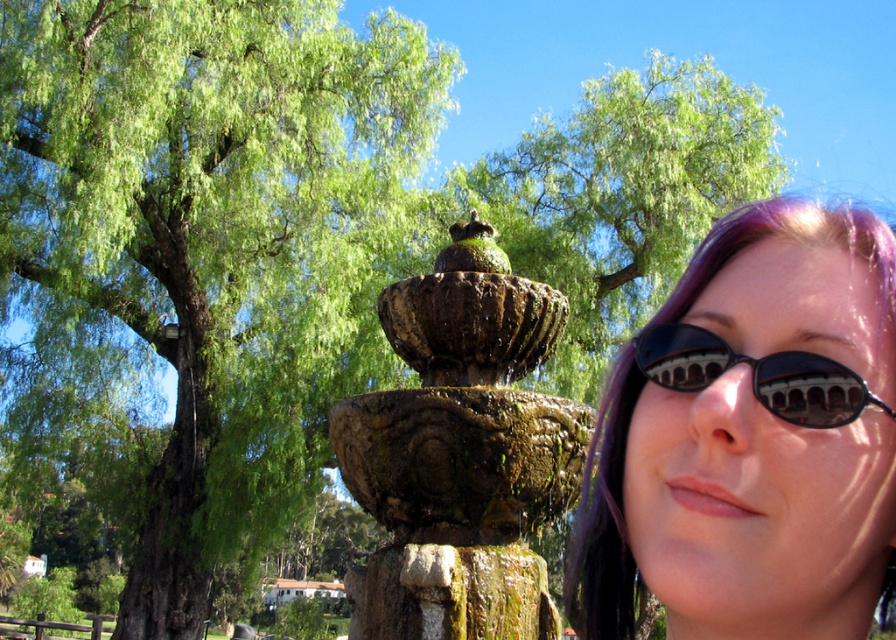
Question: Is purple hair at center further to the viewer compared to green mossy stone fountain at center?

Choices:
 (A) no
 (B) yes

Answer: (A)

Question: In this image, where is green leafy tree at upper left located relative to green mossy stone fountain at center?

Choices:
 (A) left
 (B) right

Answer: (A)

Question: Can you confirm if green mossy stone fountain at center is positioned to the right of green leafy tree at center?

Choices:
 (A) no
 (B) yes

Answer: (A)

Question: Which point is closer to the camera taking this photo?

Choices:
 (A) (694, 385)
 (B) (754, 484)

Answer: (B)

Question: Which point is closer to the camera?

Choices:
 (A) (548, 188)
 (B) (892, 360)

Answer: (B)

Question: Which object is closer to the camera taking this photo?

Choices:
 (A) purple hair at center
 (B) black reflective sunglasses at right
 (C) green leafy tree at upper left
 (D) green leafy tree at center

Answer: (B)